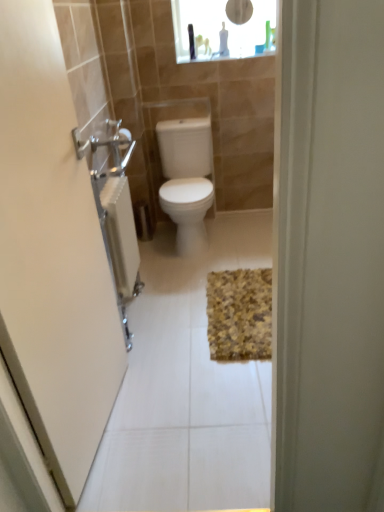
What is the approximate height of yellow textured bath mat at center?

yellow textured bath mat at center is 1.76 inches in height.

The height and width of the screenshot is (512, 384). What do you see at coordinates (52, 254) in the screenshot?
I see `brushed metal towel rack at left` at bounding box center [52, 254].

This screenshot has width=384, height=512. Describe the element at coordinates (187, 179) in the screenshot. I see `white glossy toilet at center` at that location.

Where is `transparent glass medicine cabinet at upper center`? The image size is (384, 512). transparent glass medicine cabinet at upper center is located at coordinates (222, 30).

Based on the photo, based on their positions, is yellow textured bath mat at center located to the left or right of brushed metal towel rack at left?

From the image, it's evident that yellow textured bath mat at center is to the right of brushed metal towel rack at left.

What's the angular difference between yellow textured bath mat at center and brushed metal towel rack at left's facing directions?

The angular difference between yellow textured bath mat at center and brushed metal towel rack at left is 85.1 degrees.

Which object is wider, yellow textured bath mat at center or brushed metal towel rack at left?

With larger width is yellow textured bath mat at center.

Are yellow textured bath mat at center and brushed metal towel rack at left far apart?

yellow textured bath mat at center is near brushed metal towel rack at left, not far away.

Considering the positions of objects transparent glass medicine cabinet at upper center and white glossy toilet at center in the image provided, who is behind, transparent glass medicine cabinet at upper center or white glossy toilet at center?

transparent glass medicine cabinet at upper center.

Considering the relative sizes of transparent glass medicine cabinet at upper center and white glossy toilet at center in the image provided, is transparent glass medicine cabinet at upper center wider than white glossy toilet at center?

No, transparent glass medicine cabinet at upper center is not wider than white glossy toilet at center.

Is point (229, 44) closer or farther from the camera than point (208, 183)?

Point (229, 44).

Is transparent glass medicine cabinet at upper center taller than white glossy toilet at center?

No, transparent glass medicine cabinet at upper center is not taller than white glossy toilet at center.

Relative to yellow textured bath mat at center, is white glossy toilet at center in front or behind?

In the image, white glossy toilet at center appears behind yellow textured bath mat at center.

Is yellow textured bath mat at center located within white glossy toilet at center?

No, yellow textured bath mat at center is not a part of white glossy toilet at center.

Is white glossy toilet at center at the right side of yellow textured bath mat at center?

In fact, white glossy toilet at center is to the left of yellow textured bath mat at center.

In terms of width, does white glossy toilet at center look wider or thinner when compared to yellow textured bath mat at center?

Clearly, white glossy toilet at center has less width compared to yellow textured bath mat at center.

Is white glossy toilet at center facing away from transparent glass medicine cabinet at upper center?

No, white glossy toilet at center's orientation is not away from transparent glass medicine cabinet at upper center.

From the image's perspective, is white glossy toilet at center below transparent glass medicine cabinet at upper center?

Yes, from the image's perspective, white glossy toilet at center is beneath transparent glass medicine cabinet at upper center.

Consider the image. Is white glossy toilet at center placed right next to transparent glass medicine cabinet at upper center?

white glossy toilet at center and transparent glass medicine cabinet at upper center are not in contact.

Would you say white glossy toilet at center is inside or outside brushed metal towel rack at left?

white glossy toilet at center is not inside brushed metal towel rack at left, it's outside.

From the image's perspective, who appears lower, white glossy toilet at center or brushed metal towel rack at left?

brushed metal towel rack at left.

Considering the sizes of white glossy toilet at center and brushed metal towel rack at left in the image, is white glossy toilet at center taller or shorter than brushed metal towel rack at left?

Considering their sizes, white glossy toilet at center has less height than brushed metal towel rack at left.

Between white glossy toilet at center and brushed metal towel rack at left, which one appears on the left side from the viewer's perspective?

brushed metal towel rack at left is more to the left.

Considering the relative sizes of brushed metal towel rack at left and yellow textured bath mat at center in the image provided, is brushed metal towel rack at left taller than yellow textured bath mat at center?

Indeed, brushed metal towel rack at left has a greater height compared to yellow textured bath mat at center.

Considering the positions of objects brushed metal towel rack at left and yellow textured bath mat at center in the image provided, who is in front, brushed metal towel rack at left or yellow textured bath mat at center?

Positioned in front is brushed metal towel rack at left.

Find the location of a particular element. bath mat that appears below the brushed metal towel rack at left (from the image's perspective) is located at coordinates (240, 314).

From the image's perspective, is brushed metal towel rack at left under yellow textured bath mat at center?

No, from the image's perspective, brushed metal towel rack at left is not beneath yellow textured bath mat at center.

Which is less distant, [235,47] or [214,332]?

Clearly, point [235,47] is more distant from the camera than point [214,332].

From a real-world perspective, who is located higher, transparent glass medicine cabinet at upper center or yellow textured bath mat at center?

In real-world perspective, transparent glass medicine cabinet at upper center is above.

What's the angular difference between transparent glass medicine cabinet at upper center and yellow textured bath mat at center's facing directions?

There is a 0.489-degree angle between the facing directions of transparent glass medicine cabinet at upper center and yellow textured bath mat at center.

Can you confirm if transparent glass medicine cabinet at upper center is smaller than yellow textured bath mat at center?

Incorrect, transparent glass medicine cabinet at upper center is not smaller in size than yellow textured bath mat at center.

Find the location of `bath mat below the brushed metal towel rack at left (from a real-world perspective)`. bath mat below the brushed metal towel rack at left (from a real-world perspective) is located at coordinates (240, 314).

At what (x,y) coordinates should I click in order to perform the action: click on medicine cabinet on the right of the white glossy toilet at center. Please return your answer as a coordinate pair (x, y). Image resolution: width=384 pixels, height=512 pixels. Looking at the image, I should click on (222, 30).

Looking at the image, which one is located closer to white glossy toilet at center, brushed metal towel rack at left or transparent glass medicine cabinet at upper center?

The object closer to white glossy toilet at center is transparent glass medicine cabinet at upper center.

Looking at the image, which one is located closer to white glossy toilet at center, yellow textured bath mat at center or brushed metal towel rack at left?

yellow textured bath mat at center lies closer to white glossy toilet at center than the other object.

Considering their positions, is white glossy toilet at center positioned closer to brushed metal towel rack at left than transparent glass medicine cabinet at upper center?

white glossy toilet at center is closer to brushed metal towel rack at left.

Estimate the real-world distances between objects in this image. Which object is further from brushed metal towel rack at left, transparent glass medicine cabinet at upper center or white glossy toilet at center?

transparent glass medicine cabinet at upper center is positioned further to the anchor brushed metal towel rack at left.

Looking at the image, which one is located closer to brushed metal towel rack at left, yellow textured bath mat at center or transparent glass medicine cabinet at upper center?

yellow textured bath mat at center is positioned closer to the anchor brushed metal towel rack at left.

Based on their spatial positions, is yellow textured bath mat at center or brushed metal towel rack at left closer to transparent glass medicine cabinet at upper center?

yellow textured bath mat at center lies closer to transparent glass medicine cabinet at upper center than the other object.

Estimate the real-world distances between objects in this image. Which object is closer to yellow textured bath mat at center, transparent glass medicine cabinet at upper center or brushed metal towel rack at left?

brushed metal towel rack at left is positioned closer to the anchor yellow textured bath mat at center.

Estimate the real-world distances between objects in this image. Which object is closer to yellow textured bath mat at center, white glossy toilet at center or brushed metal towel rack at left?

Among the two, white glossy toilet at center is located nearer to yellow textured bath mat at center.

Locate an element on the screen. The width and height of the screenshot is (384, 512). toilet that lies between transparent glass medicine cabinet at upper center and yellow textured bath mat at center from top to bottom is located at coordinates (187, 179).

Find the location of `bath mat between brushed metal towel rack at left and white glossy toilet at center from front to back`. bath mat between brushed metal towel rack at left and white glossy toilet at center from front to back is located at coordinates (240, 314).

This screenshot has height=512, width=384. Find the location of `bath mat between brushed metal towel rack at left and transparent glass medicine cabinet at upper center along the z-axis`. bath mat between brushed metal towel rack at left and transparent glass medicine cabinet at upper center along the z-axis is located at coordinates (240, 314).

Locate an element on the screen. This screenshot has width=384, height=512. toilet between brushed metal towel rack at left and transparent glass medicine cabinet at upper center along the z-axis is located at coordinates (187, 179).